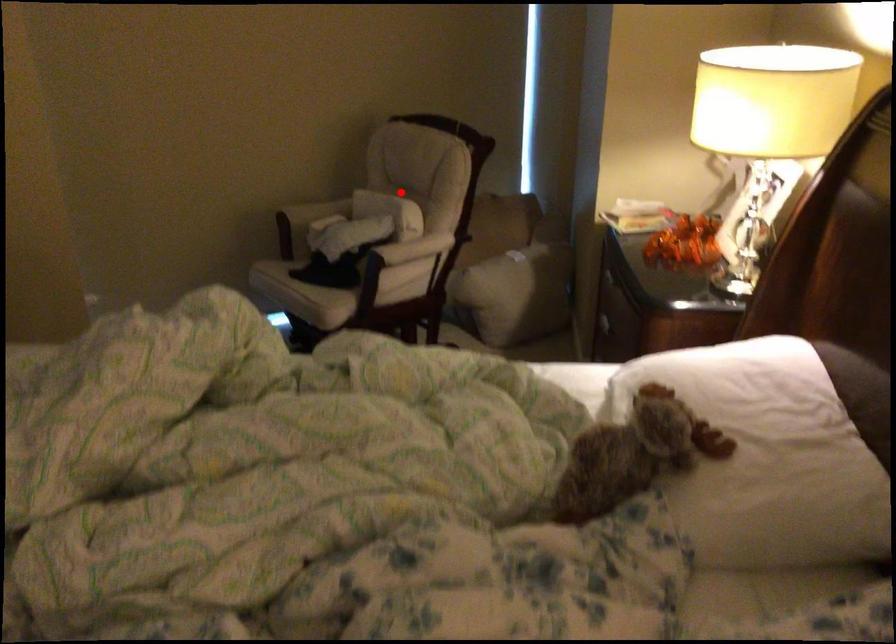
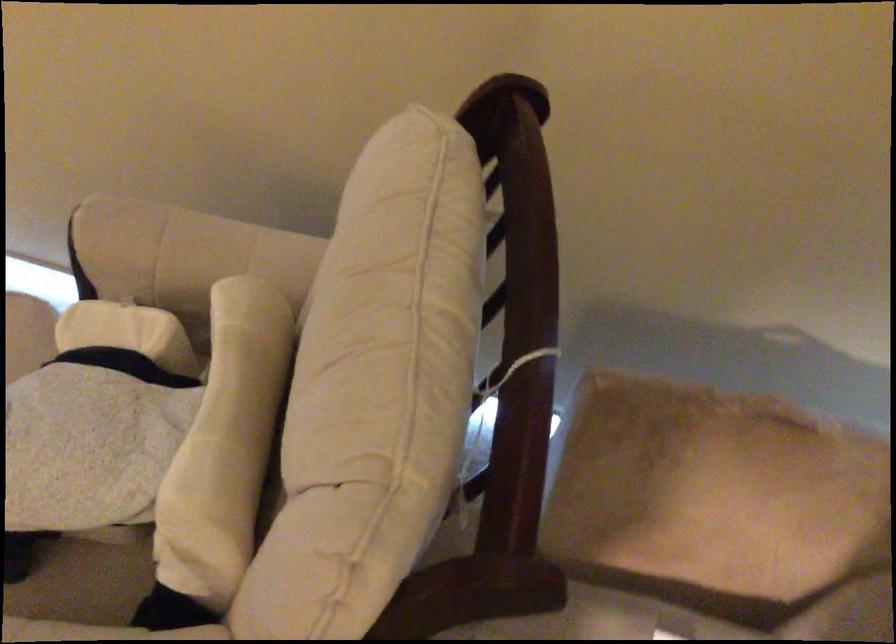
Question: A red point is marked in image1. In image2, is the corresponding 3D point closer to the camera or farther? Reply with the corresponding letter.

Choices:
 (A) The corresponding 3D point is closer.
 (B) The corresponding 3D point is farther.

Answer: (A)